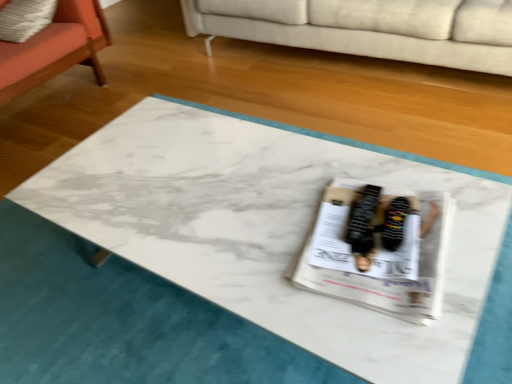
This screenshot has height=384, width=512. What do you see at coordinates (394, 223) in the screenshot?
I see `black suede sneakers at center` at bounding box center [394, 223].

What is the approximate width of black suede sneakers at center?

2.33 inches.

What do you see at coordinates (55, 49) in the screenshot? I see `orange fabric chair at left` at bounding box center [55, 49].

This screenshot has height=384, width=512. I want to click on beige fabric couch at upper center, so click(x=369, y=28).

This screenshot has height=384, width=512. In order to click on black suede sneakers at center in this screenshot , I will do `click(394, 223)`.

Is beige fabric couch at upper center turned away from white glossy magazine at center?

No, beige fabric couch at upper center is not facing the opposite direction of white glossy magazine at center.

Can you confirm if beige fabric couch at upper center is thinner than white glossy magazine at center?

No, beige fabric couch at upper center is not thinner than white glossy magazine at center.

From a real-world perspective, is beige fabric couch at upper center positioned over white glossy magazine at center based on gravity?

No, from a real-world perspective, beige fabric couch at upper center is not above white glossy magazine at center.

Is beige fabric couch at upper center inside the boundaries of white glossy magazine at center, or outside?

beige fabric couch at upper center is outside white glossy magazine at center.

Are beige fabric couch at upper center and black suede sneakers at center beside each other?

No, beige fabric couch at upper center is not beside black suede sneakers at center.

Is beige fabric couch at upper center taller than black suede sneakers at center?

Yes, beige fabric couch at upper center is taller than black suede sneakers at center.

Is black suede sneakers at center completely or partially inside beige fabric couch at upper center?

Definitely not — black suede sneakers at center is not inside beige fabric couch at upper center.

From the image's perspective, is beige fabric couch at upper center positioned above or below black suede sneakers at center?

Based on their image positions, beige fabric couch at upper center is located above black suede sneakers at center.

Can we say black suede sneakers at center lies outside white glossy magazine at center?

Actually, black suede sneakers at center is at least partially inside white glossy magazine at center.

From the picture: From the image's perspective, who appears lower, black suede sneakers at center or white glossy magazine at center?

white glossy magazine at center, from the image's perspective.

Which of these two, black suede sneakers at center or white glossy magazine at center, is wider?

With larger width is white glossy magazine at center.

Based on their sizes in the image, would you say orange fabric chair at left is bigger or smaller than white glossy magazine at center?

In the image, orange fabric chair at left appears to be larger than white glossy magazine at center.

Would you say orange fabric chair at left is a long distance from white glossy magazine at center?

Yes, orange fabric chair at left and white glossy magazine at center are quite far apart.

Does orange fabric chair at left have a greater height compared to white glossy magazine at center?

Indeed, orange fabric chair at left has a greater height compared to white glossy magazine at center.

From the image's perspective, is black suede sneakers at center positioned above or below beige fabric couch at upper center?

Clearly, from the image's perspective, black suede sneakers at center is below beige fabric couch at upper center.

Considering the sizes of objects black suede sneakers at center and beige fabric couch at upper center in the image provided, who is shorter, black suede sneakers at center or beige fabric couch at upper center?

black suede sneakers at center is shorter.

This screenshot has width=512, height=384. I want to click on footwear that appears in front of the beige fabric couch at upper center, so click(x=394, y=223).

Which object is positioned more to the right, black suede sneakers at center or beige fabric couch at upper center?

Positioned to the right is beige fabric couch at upper center.

Can we say orange fabric chair at left lies outside black suede sneakers at center?

Yes.

Considering the relative sizes of orange fabric chair at left and black suede sneakers at center in the image provided, is orange fabric chair at left bigger than black suede sneakers at center?

Correct, orange fabric chair at left is larger in size than black suede sneakers at center.

Can you confirm if orange fabric chair at left is positioned to the left of black suede sneakers at center?

Correct, you'll find orange fabric chair at left to the left of black suede sneakers at center.

Which object is wider, orange fabric chair at left or black suede sneakers at center?

orange fabric chair at left is wider.

From a real-world perspective, is white glossy magazine at center over beige fabric couch at upper center?

Yes, from a real-world perspective, white glossy magazine at center is above beige fabric couch at upper center.

Based on the photo, does white glossy magazine at center have a lesser width compared to beige fabric couch at upper center?

Yes.

From the image's perspective, which one is positioned lower, white glossy magazine at center or beige fabric couch at upper center?

white glossy magazine at center appears lower in the image.

Is point (409, 274) behind point (449, 62)?

No, it is in front of (449, 62).

Find the location of a particular element. magazine above the beige fabric couch at upper center (from a real-world perspective) is located at coordinates (379, 249).

Locate an element on the screen. The width and height of the screenshot is (512, 384). footwear to the left of beige fabric couch at upper center is located at coordinates (394, 223).

Based on their spatial positions, is beige fabric couch at upper center or orange fabric chair at left closer to white glossy magazine at center?

Based on the image, beige fabric couch at upper center appears to be nearer to white glossy magazine at center.

When comparing their distances from orange fabric chair at left, does white glossy magazine at center or beige fabric couch at upper center seem further?

white glossy magazine at center lies further to orange fabric chair at left than the other object.

Considering their positions, is beige fabric couch at upper center positioned further to black suede sneakers at center than orange fabric chair at left?

orange fabric chair at left.

Estimate the real-world distances between objects in this image. Which object is further from orange fabric chair at left, white glossy magazine at center or black suede sneakers at center?

black suede sneakers at center lies further to orange fabric chair at left than the other object.

From the image, which object appears to be nearer to orange fabric chair at left, beige fabric couch at upper center or black suede sneakers at center?

beige fabric couch at upper center lies closer to orange fabric chair at left than the other object.

When comparing their distances from white glossy magazine at center, does orange fabric chair at left or beige fabric couch at upper center seem further?

Among the two, orange fabric chair at left is located further to white glossy magazine at center.

When comparing their distances from black suede sneakers at center, does orange fabric chair at left or white glossy magazine at center seem closer?

white glossy magazine at center is positioned closer to the anchor black suede sneakers at center.

When comparing their distances from black suede sneakers at center, does orange fabric chair at left or beige fabric couch at upper center seem further?

Among the two, orange fabric chair at left is located further to black suede sneakers at center.

The height and width of the screenshot is (384, 512). Find the location of `magazine situated between orange fabric chair at left and beige fabric couch at upper center from left to right`. magazine situated between orange fabric chair at left and beige fabric couch at upper center from left to right is located at coordinates (379, 249).

Locate an element on the screen. The image size is (512, 384). magazine between orange fabric chair at left and black suede sneakers at center in the horizontal direction is located at coordinates (379, 249).

The width and height of the screenshot is (512, 384). In order to click on footwear between beige fabric couch at upper center and white glossy magazine at center from top to bottom in this screenshot , I will do pyautogui.click(x=394, y=223).

Where is `footwear between orange fabric chair at left and beige fabric couch at upper center`? The height and width of the screenshot is (384, 512). footwear between orange fabric chair at left and beige fabric couch at upper center is located at coordinates pyautogui.click(x=394, y=223).